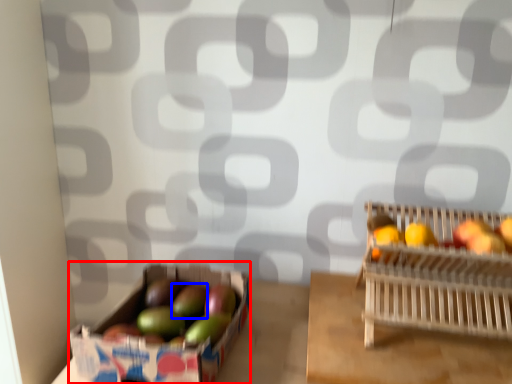
Question: Which object appears farthest to the camera in this image, cardboard box (highlighted by a red box) or apple (highlighted by a blue box)?

Choices:
 (A) cardboard box
 (B) apple

Answer: (B)